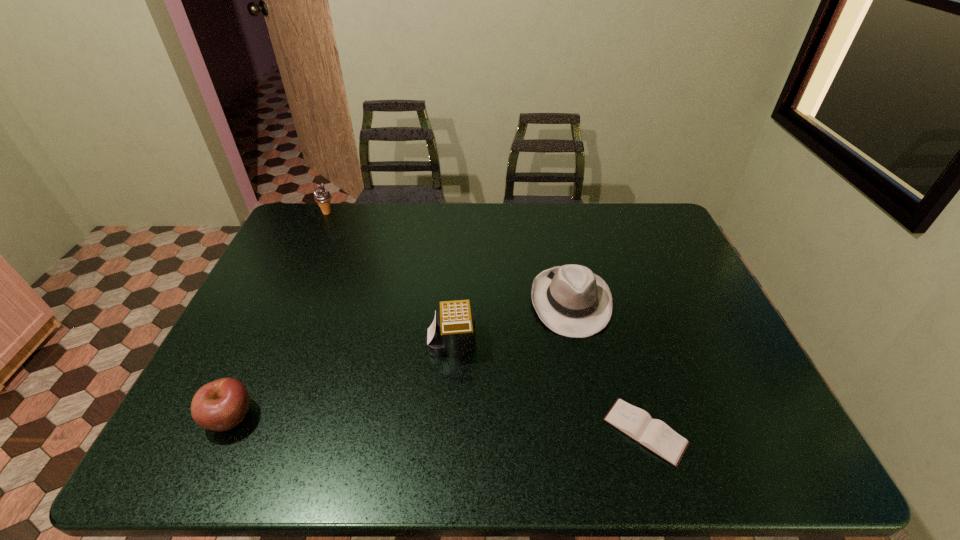
Locate an element on the screen. blank space at the right edge of the desktop is located at coordinates (724, 383).

In the image, there is a desktop. Where is `vacant space at the near right corner`? vacant space at the near right corner is located at coordinates (743, 434).

What are the coordinates of `vacant area between the shortest object and the calculator` in the screenshot? It's located at (548, 388).

This screenshot has height=540, width=960. What are the coordinates of `vacant space that is in between the third object from right to left and the farthest object` in the screenshot? It's located at (389, 278).

This screenshot has width=960, height=540. In order to click on free spot between the apple and the calculator in this screenshot , I will do `click(341, 380)`.

Locate an element on the screen. free space between the apple and the calculator is located at coordinates (341, 380).

You are a GUI agent. You are given a task and a screenshot of the screen. Output one action in this format:
    pyautogui.click(x=<x>, y=<y>)
    Task: Click on the free point between the fedora and the calculator
    
    Given the screenshot: What is the action you would take?
    pyautogui.click(x=511, y=323)

Locate an element on the screen. This screenshot has height=540, width=960. free space that is in between the calculator and the fedora is located at coordinates (511, 323).

The image size is (960, 540). Identify the location of free spot between the fedora and the apple. (400, 360).

Where is `free spot between the calculator and the apple`? The width and height of the screenshot is (960, 540). free spot between the calculator and the apple is located at coordinates (341, 380).